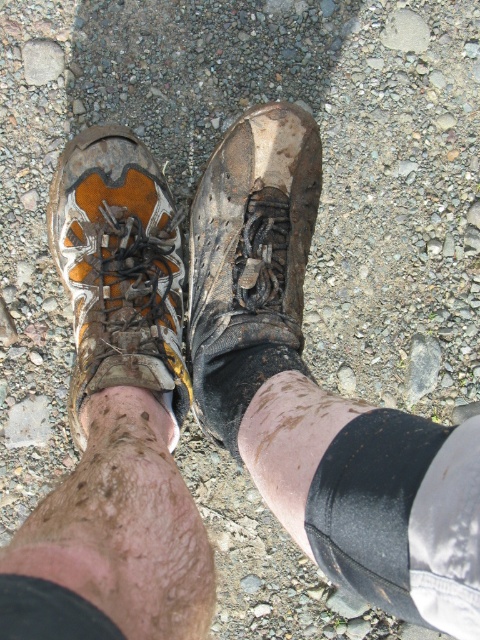
What is the color and material of the fabric at the point marked by coordinates [372,506]?

The fabric at coordinates [372,506] is black and made of matte soft material.